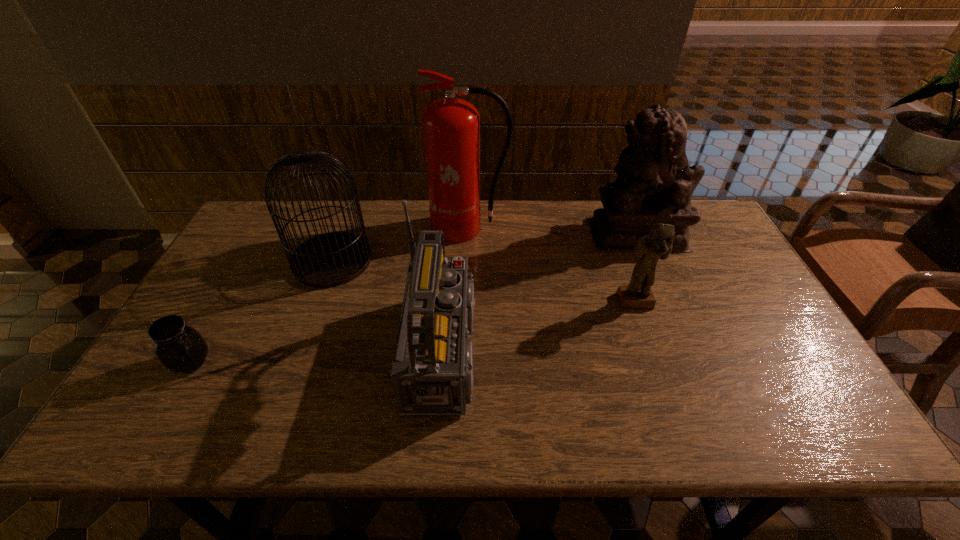
Where is `vacant region located 0.290m on the front-facing side of the sculpture`? The height and width of the screenshot is (540, 960). vacant region located 0.290m on the front-facing side of the sculpture is located at coordinates (502, 234).

This screenshot has height=540, width=960. I want to click on free spot located 0.230m on the right of the birdcage, so click(446, 260).

Identify the location of free space located 0.270m on the front-facing side of the radio receiver. This screenshot has height=540, width=960. (606, 351).

Image resolution: width=960 pixels, height=540 pixels. I want to click on free point located on the front-facing side of the fifth tallest object, so click(680, 431).

Locate an element on the screen. Image resolution: width=960 pixels, height=540 pixels. free spot located on the lid of the shortest object is located at coordinates (289, 362).

Image resolution: width=960 pixels, height=540 pixels. Find the location of `fire extinguisher situated at the far edge`. fire extinguisher situated at the far edge is located at coordinates (451, 126).

Locate an element on the screen. sculpture that is at the far edge is located at coordinates (655, 183).

Where is `birdcage at the far edge`? Image resolution: width=960 pixels, height=540 pixels. birdcage at the far edge is located at coordinates (331, 259).

Locate an element on the screen. The height and width of the screenshot is (540, 960). object situated at the near edge is located at coordinates (432, 371).

Locate an element on the screen. The image size is (960, 540). object that is positioned at the left edge is located at coordinates (180, 348).